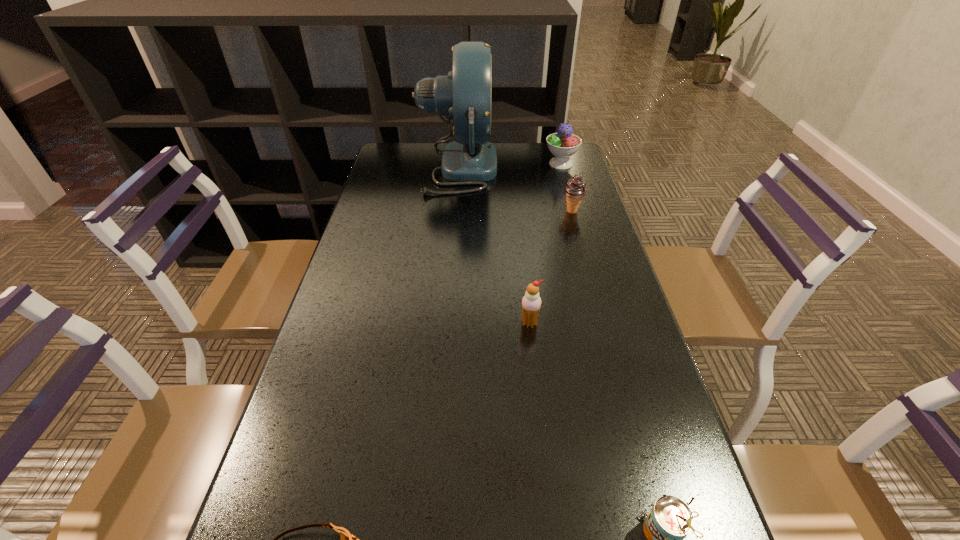
Image resolution: width=960 pixels, height=540 pixels. I want to click on free point between the tallest object and the second farthest icecream, so click(x=516, y=190).

Where is `vacant space that is in between the third nearest object and the second nearest icecream`? vacant space that is in between the third nearest object and the second nearest icecream is located at coordinates (551, 267).

Point out which object is positioned as the nearest to the farthest icecream. Please provide its 2D coordinates. Your answer should be formatted as a tuple, i.e. [(x, y)], where the tuple contains the x and y coordinates of a point satisfying the conditions above.

[(465, 95)]

Select which object is the fourth closest to the fourth nearest object. Please provide its 2D coordinates. Your answer should be formatted as a tuple, i.e. [(x, y)], where the tuple contains the x and y coordinates of a point satisfying the conditions above.

[(670, 520)]

Where is `the second closest icecream to the fan`? the second closest icecream to the fan is located at coordinates (575, 189).

Locate an element on the screen. The image size is (960, 540). the third closest icecream to the can is located at coordinates (563, 144).